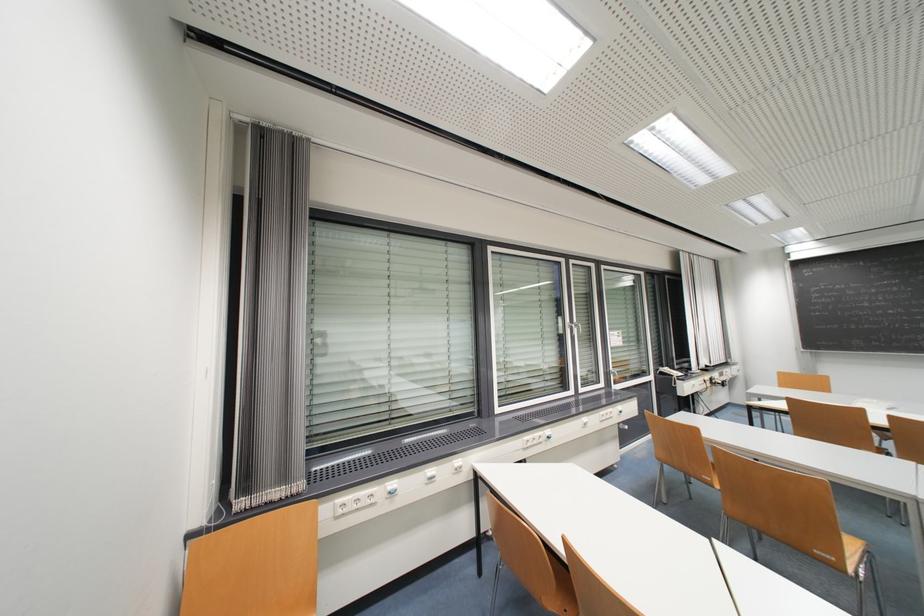
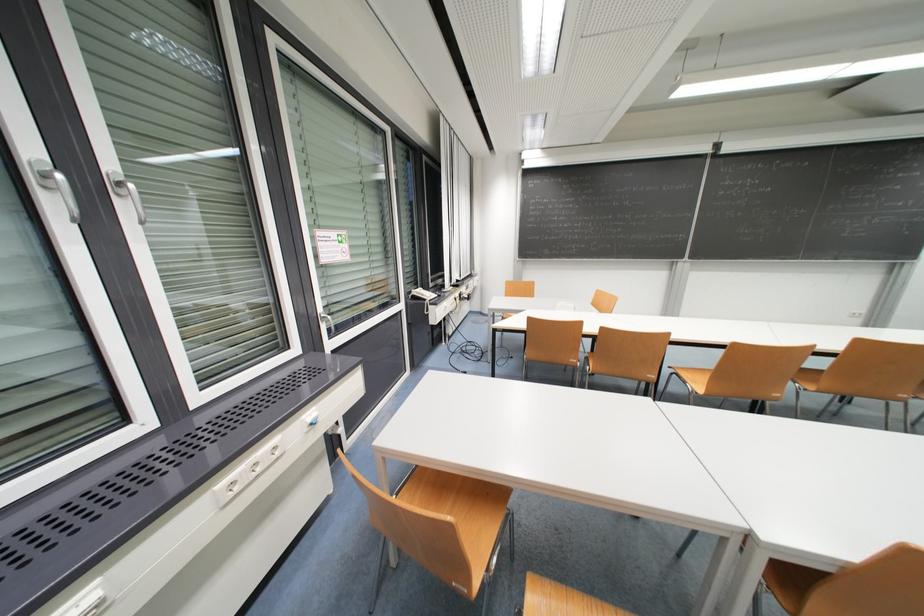
The point at (672,371) is marked in the first image. Where is the corresponding point in the second image?

(426, 293)